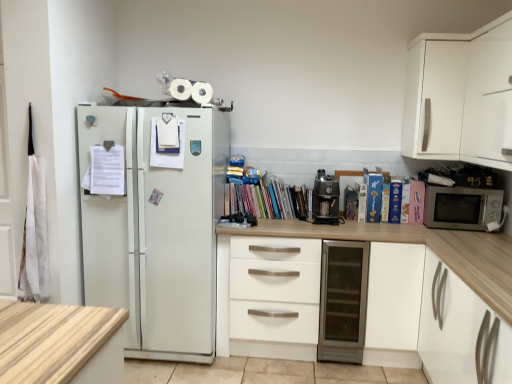
At what (x,y) coordinates should I click in order to perform the action: click on vacant area that is in front of pink matte paperback book at right, acting as the 1th paperback book starting from the right. Please return your answer as a coordinate pair (x, y). Image resolution: width=512 pixels, height=384 pixels. Looking at the image, I should click on (417, 228).